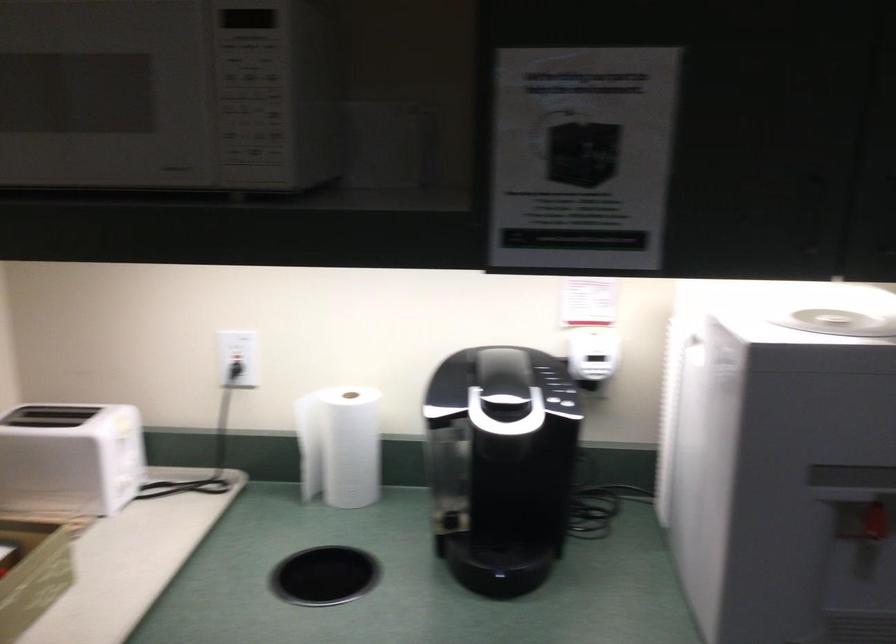
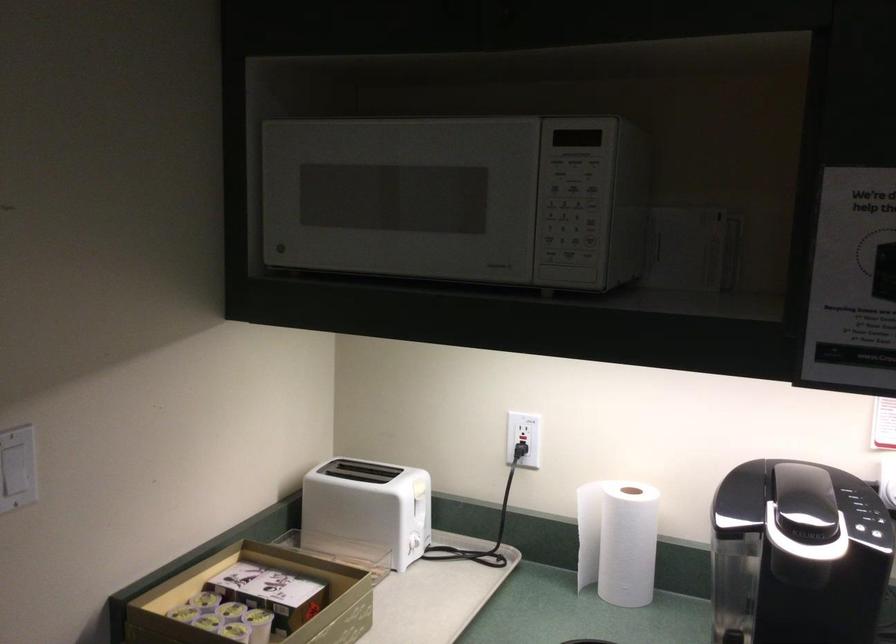
Find the pixel in the second image that matches [115,483] in the first image.

(408, 542)